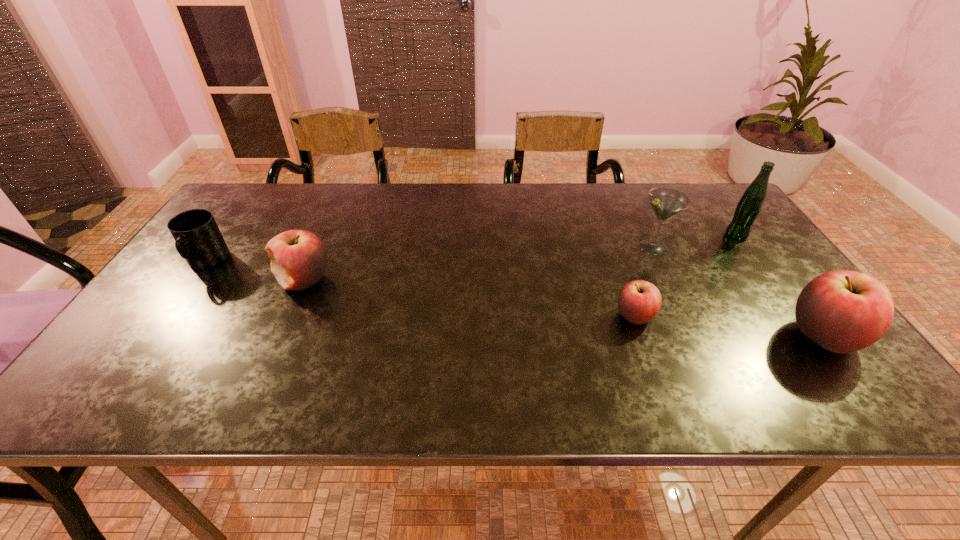
At what (x,y) coordinates should I click in order to perform the action: click on vacant space positioned on the right of the second apple from right to left. Please return your answer as a coordinate pair (x, y). Looking at the image, I should click on pos(723,316).

Locate an element on the screen. vacant space located 0.180m on the back of the rightmost apple is located at coordinates (767, 262).

The height and width of the screenshot is (540, 960). Find the location of `free spot located on the left of the beer bottle`. free spot located on the left of the beer bottle is located at coordinates (621, 235).

This screenshot has width=960, height=540. I want to click on free point located 0.080m on the side of the second shortest object with the handle, so click(x=179, y=301).

Identify the location of free region located 0.200m on the back of the martini. (630, 199).

Where is `object present at the near edge`? The width and height of the screenshot is (960, 540). object present at the near edge is located at coordinates (843, 311).

The width and height of the screenshot is (960, 540). I want to click on object positioned at the left edge, so click(198, 239).

Identify the location of apple that is at the right edge. This screenshot has height=540, width=960. (843, 311).

Identify the location of beer bottle that is at the right edge. (748, 208).

Where is `object situated at the near right corner`? This screenshot has width=960, height=540. object situated at the near right corner is located at coordinates (843, 311).